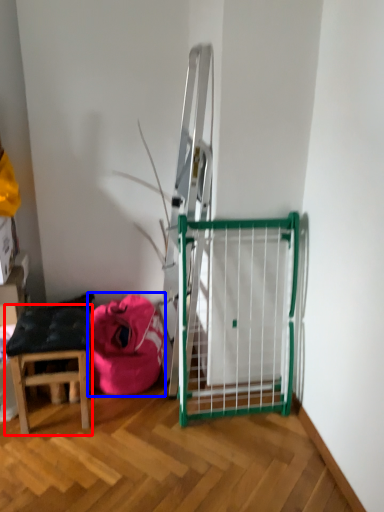
Question: Which object is closer to the camera taking this photo, stool (highlighted by a red box) or bean bag chair (highlighted by a blue box)?

Choices:
 (A) stool
 (B) bean bag chair

Answer: (A)